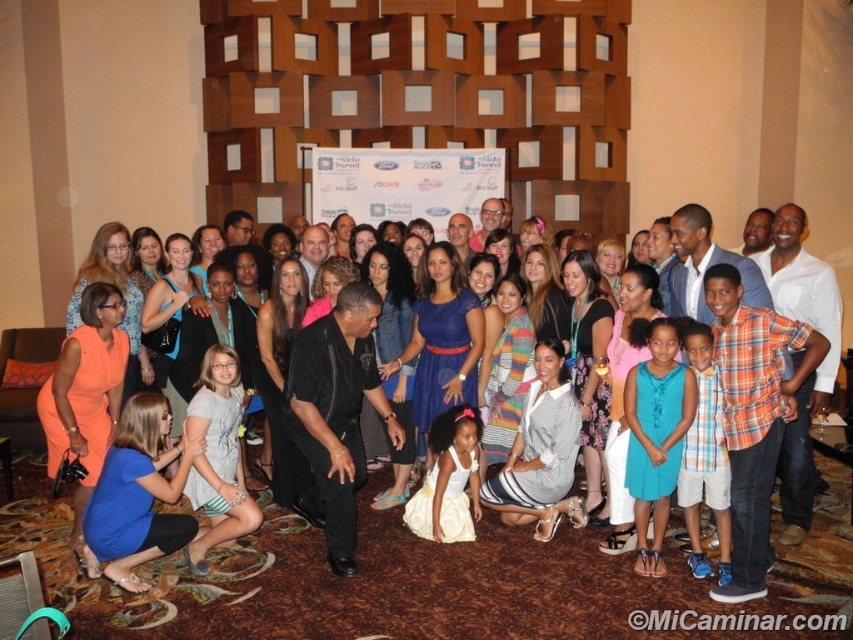
Does plaid sleeveless shirt at center appear on the left side of white satin dress at center?

In fact, plaid sleeveless shirt at center is to the right of white satin dress at center.

Describe the element at coordinates (704, 458) in the screenshot. I see `plaid sleeveless shirt at center` at that location.

You are a GUI agent. You are given a task and a screenshot of the screen. Output one action in this format:
    pyautogui.click(x=<x>, y=<y>)
    Task: Click on the plaid sleeveless shirt at center
    The width and height of the screenshot is (853, 640).
    Given the screenshot: What is the action you would take?
    pyautogui.click(x=704, y=458)

Is teal satin dress at center taller than plaid sleeveless shirt at center?

Correct, teal satin dress at center is much taller as plaid sleeveless shirt at center.

Is teal satin dress at center thinner than plaid sleeveless shirt at center?

In fact, teal satin dress at center might be wider than plaid sleeveless shirt at center.

Is point (677, 468) farther from camera compared to point (726, 554)?

Yes, point (677, 468) is behind point (726, 554).

Identify the location of teal satin dress at center. This screenshot has height=640, width=853. (654, 435).

Which of these two, black matte dress at center or white satin dress at center, stands taller?

With more height is black matte dress at center.

Between black matte dress at center and white satin dress at center, which one has less height?

With less height is white satin dress at center.

From the picture: Who is more forward, (825,552) or (432,429)?

Positioned in front is point (825,552).

I want to click on black matte dress at center, so click(x=820, y=556).